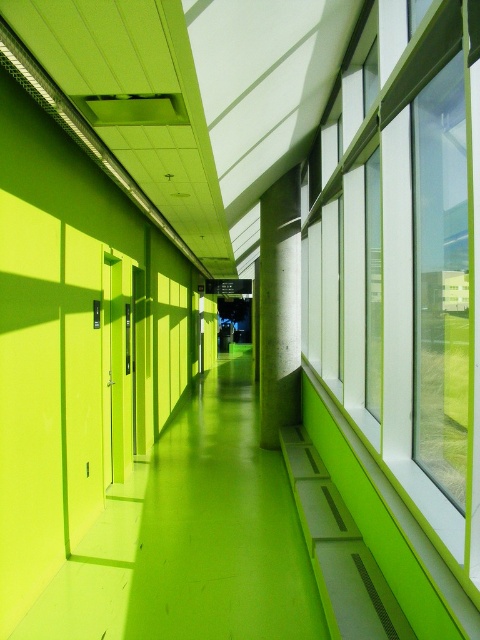
Is point (350, 372) positioned after point (264, 412)?

No, it is not.

Is point (405, 428) closer to camera compared to point (295, 340)?

Yes, it is in front of point (295, 340).

This screenshot has height=640, width=480. I want to click on transparent glass windows at right, so click(x=406, y=262).